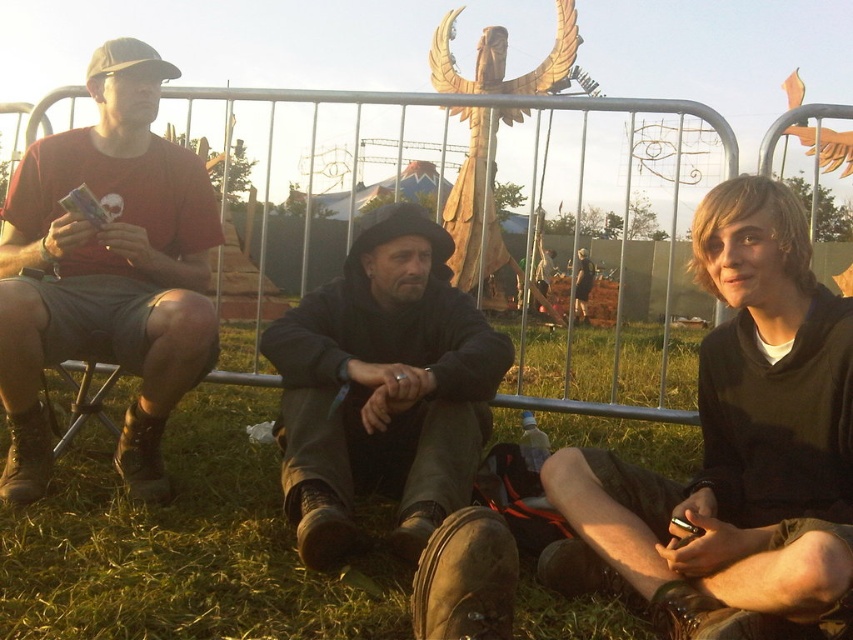
Question: Does black matte hoodie at center appear on the left side of matte black shirt at left?

Choices:
 (A) yes
 (B) no

Answer: (B)

Question: Which of the following is the closest to the observer?

Choices:
 (A) matte black shirt at left
 (B) dark gray fabric jacket at center
 (C) black matte hoodie at center
 (D) metallic silver fence at center

Answer: (C)

Question: Can you confirm if black matte hoodie at center is positioned to the right of matte black shirt at left?

Choices:
 (A) yes
 (B) no

Answer: (A)

Question: Which of the following is the closest to the observer?

Choices:
 (A) matte black shirt at left
 (B) metallic silver fence at center
 (C) dark gray fabric jacket at center

Answer: (C)

Question: Which point is closer to the camera taking this photo?

Choices:
 (A) (773, 136)
 (B) (20, 182)
 (C) (792, 259)
 (D) (347, 362)

Answer: (C)

Question: Can you confirm if dark gray fabric jacket at center is thinner than metallic silver fence at center?

Choices:
 (A) yes
 (B) no

Answer: (A)